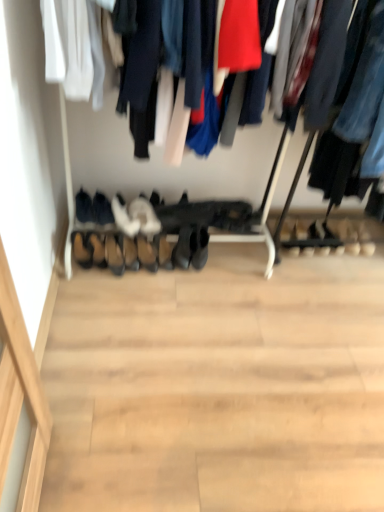
Question: Is brown leather shoe at center, the 6th footwear viewed from the left, at the right side of brown suede shoes at center, acting as the third footwear starting from the left?

Choices:
 (A) yes
 (B) no

Answer: (A)

Question: Considering the relative sizes of brown leather shoe at center, the 6th footwear viewed from the left, and brown suede shoes at center, acting as the third footwear starting from the left, in the image provided, is brown leather shoe at center, the 6th footwear viewed from the left, smaller than brown suede shoes at center, acting as the third footwear starting from the left,?

Choices:
 (A) no
 (B) yes

Answer: (B)

Question: Is brown suede shoes at center, acting as the third footwear starting from the left, a part of brown leather shoe at center, which ranks as the 1th footwear in right-to-left order?

Choices:
 (A) no
 (B) yes

Answer: (A)

Question: Is brown leather shoe at center, the 6th footwear viewed from the left, looking in the opposite direction of brown suede shoes at center, which is counted as the 4th footwear, starting from the right?

Choices:
 (A) no
 (B) yes

Answer: (A)

Question: From a real-world perspective, is brown leather shoe at center, the 6th footwear viewed from the left, located beneath brown suede shoes at center, acting as the third footwear starting from the left?

Choices:
 (A) no
 (B) yes

Answer: (A)

Question: Is there a large distance between brown leather shoe at center, the 6th footwear viewed from the left, and brown suede shoes at center, which is counted as the 4th footwear, starting from the right?

Choices:
 (A) no
 (B) yes

Answer: (A)

Question: Is brown suede shoes at center, which is counted as the 4th footwear, starting from the right, at the right side of leather at center, which ranks as the 1th shoe in right-to-left order?

Choices:
 (A) yes
 (B) no

Answer: (B)

Question: Considering the relative sizes of brown suede shoes at center, which is counted as the 4th footwear, starting from the right, and leather at center, the fourth shoe in the left-to-right sequence, in the image provided, is brown suede shoes at center, which is counted as the 4th footwear, starting from the right, taller than leather at center, the fourth shoe in the left-to-right sequence,?

Choices:
 (A) yes
 (B) no

Answer: (B)

Question: Can you confirm if brown suede shoes at center, acting as the third footwear starting from the left, is shorter than leather at center, the fourth shoe in the left-to-right sequence?

Choices:
 (A) no
 (B) yes

Answer: (B)

Question: Is leather at center, which ranks as the 1th shoe in right-to-left order, inside brown suede shoes at center, which is counted as the 4th footwear, starting from the right?

Choices:
 (A) no
 (B) yes

Answer: (A)

Question: Is brown suede shoes at center, acting as the third footwear starting from the left, bigger than leather at center, the fourth shoe in the left-to-right sequence?

Choices:
 (A) yes
 (B) no

Answer: (A)

Question: Does brown suede shoes at center, acting as the third footwear starting from the left, have a lesser width compared to leather at center, the fourth shoe in the left-to-right sequence?

Choices:
 (A) yes
 (B) no

Answer: (B)

Question: Is brown leather shoe at lower center, which is the third shoe in right-to-left order, at the left side of white suede shoes at center, which is the 2th footwear in right-to-left order?

Choices:
 (A) no
 (B) yes

Answer: (B)